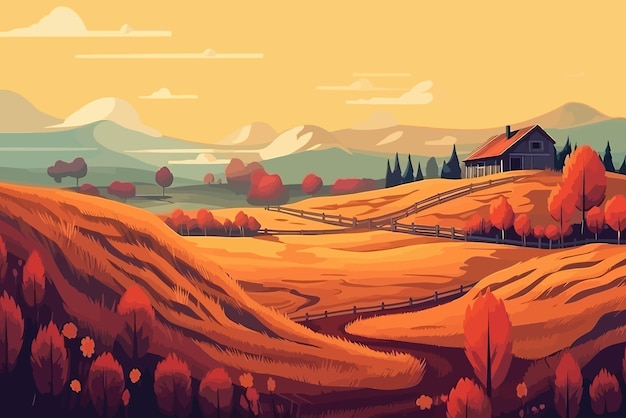
Locate an element on the screen. The width and height of the screenshot is (626, 418). chimney is located at coordinates (508, 129).